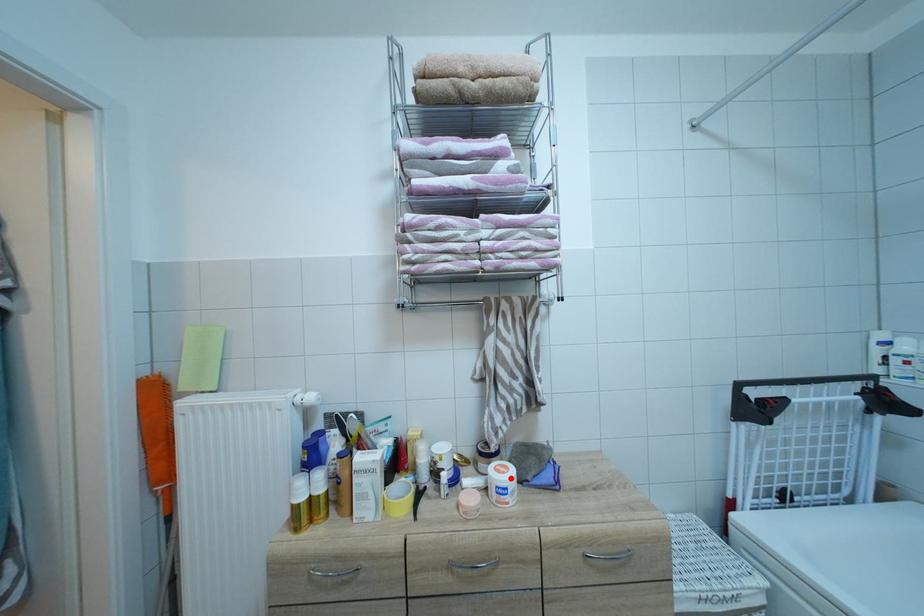
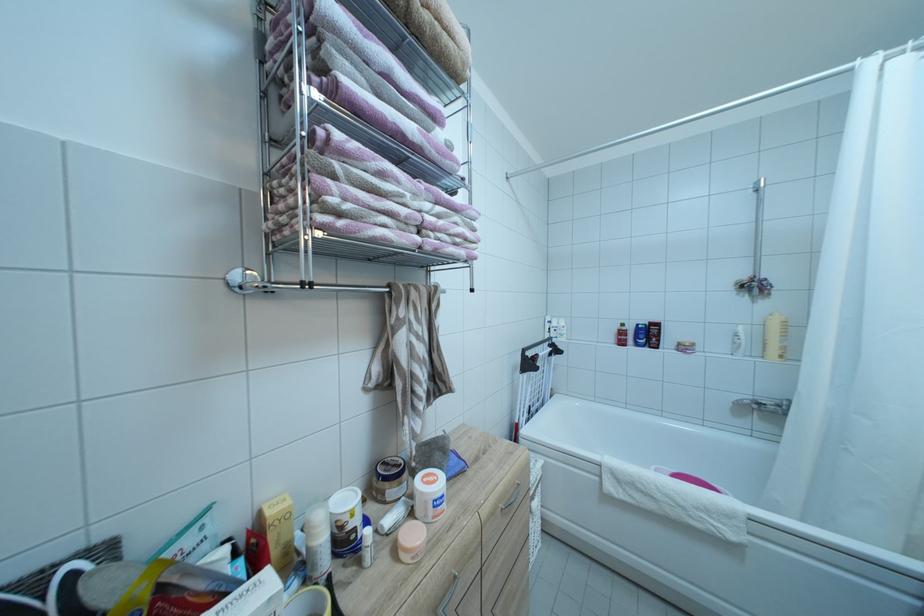
Where in the second image is the point corresponding to the highlighted location from the first image?

(442, 487)